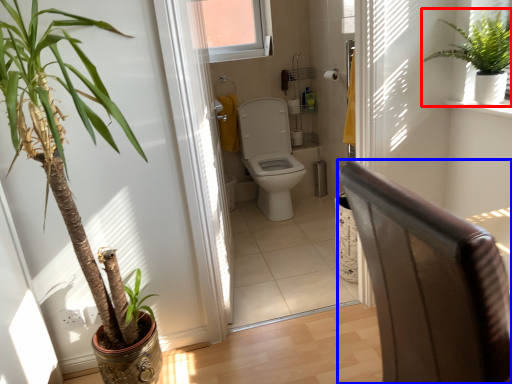
Question: Which object appears farthest to the camera in this image, houseplant (highlighted by a red box) or armchair (highlighted by a blue box)?

Choices:
 (A) houseplant
 (B) armchair

Answer: (A)